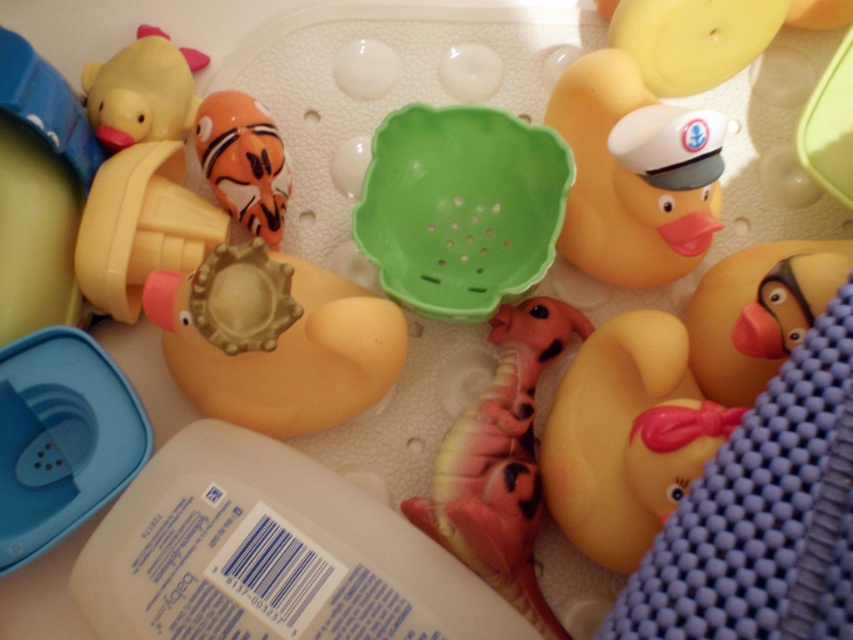
From the picture: You are a parent trying to organize bath toys. You have a small shelf where you can only place items that are shorter than 5 inches. You see the rubber duck at right and the translucent orange fish at center. Which one can fit on the shelf?

The rubber duck at right has a lesser height compared to translucent orange fish at center, so the rubber duck at right can fit on the shelf since it is shorter than 5 inches.

You are a child playing with bath toys. You see the yellow rubber duck at upper right and the pink rubber fish at center. Which toy is higher up in the image?

The yellow rubber duck at upper right is above the pink rubber fish at center, so the yellow rubber duck at upper right is higher up in the image.

You are a parent trying to locate two specific bath toys for your child. The first toy is at point (627,152) and the second is at point (506,321). Which toy is closer to your hand if you are reaching from above the bath mat?

The toy at point (627,152) is closer to your hand because it is closer to the camera than the toy at point (506,321).